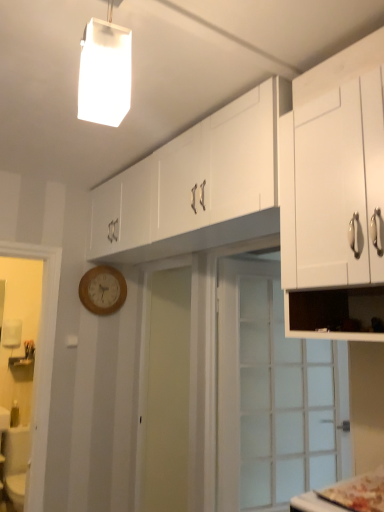
How much space does white glossy cabinet at upper center, marked as the second cabinetry in a front-to-back arrangement, occupy horizontally?

white glossy cabinet at upper center, marked as the second cabinetry in a front-to-back arrangement, is 15.90 inches in width.

Locate an element on the screen. The height and width of the screenshot is (512, 384). wooden clock at center-left is located at coordinates (102, 290).

Image resolution: width=384 pixels, height=512 pixels. What do you see at coordinates (333, 190) in the screenshot?
I see `white matte cabinet at upper right, arranged as the 1th cabinetry when viewed from the front` at bounding box center [333, 190].

Find the location of `white glossy cabinet at upper center, marked as the second cabinetry in a front-to-back arrangement`. white glossy cabinet at upper center, marked as the second cabinetry in a front-to-back arrangement is located at coordinates (194, 182).

Does wooden clock at center-left turn towards white glossy cabinet at upper center, the 1th cabinetry from the back?

Yes, wooden clock at center-left faces towards white glossy cabinet at upper center, the 1th cabinetry from the back.

From a real-world perspective, who is located lower, wooden clock at center-left or white glossy cabinet at upper center, marked as the second cabinetry in a front-to-back arrangement?

From a 3D spatial view, wooden clock at center-left is below.

Is wooden clock at center-left inside the boundaries of white glossy cabinet at upper center, the 1th cabinetry from the back, or outside?

The correct answer is: outside.

Is the surface of clear glass door at center in direct contact with white matte cabinet at upper right, arranged as the 1th cabinetry when viewed from the front?

No, clear glass door at center is not beside white matte cabinet at upper right, arranged as the 1th cabinetry when viewed from the front.

Identify the location of the 1st cabinetry above the clear glass door at center (from the image's perspective). The width and height of the screenshot is (384, 512). (333, 190).

Is clear glass door at center to the left of white matte cabinet at upper right, placed as the 2th cabinetry when sorted from back to front, from the viewer's perspective?

No, clear glass door at center is not to the left of white matte cabinet at upper right, placed as the 2th cabinetry when sorted from back to front.

Is clear glass door at center not inside white matte cabinet at upper right, arranged as the 1th cabinetry when viewed from the front?

Absolutely, clear glass door at center is external to white matte cabinet at upper right, arranged as the 1th cabinetry when viewed from the front.

Is white matte rectangular light fixture at upper center oriented away from wooden clock at center-left?

No, wooden clock at center-left is not at the back of white matte rectangular light fixture at upper center.

In the scene shown: Is white matte rectangular light fixture at upper center touching wooden clock at center-left?

There is a gap between white matte rectangular light fixture at upper center and wooden clock at center-left.

How far apart are white matte rectangular light fixture at upper center and wooden clock at center-left?

white matte rectangular light fixture at upper center and wooden clock at center-left are 1.74 meters apart from each other.

Considering the sizes of objects white matte rectangular light fixture at upper center and wooden clock at center-left in the image provided, who is smaller, white matte rectangular light fixture at upper center or wooden clock at center-left?

white matte rectangular light fixture at upper center is smaller.

Find the location of a particular element. This screenshot has height=512, width=384. clock lying behind the clear glass door at center is located at coordinates (102, 290).

Between clear glass door at center and wooden clock at center-left, which one appears on the right side from the viewer's perspective?

clear glass door at center.

Is clear glass door at center looking in the opposite direction of wooden clock at center-left?

No, clear glass door at center is not facing the opposite direction of wooden clock at center-left.

Is clear glass door at center directly adjacent to wooden clock at center-left?

clear glass door at center is not next to wooden clock at center-left, and they're not touching.

Does point (112, 311) lie in front of point (96, 19)?

That is False.

From a real-world perspective, is wooden clock at center-left beneath white matte rectangular light fixture at upper center?

Indeed, from a real-world perspective, wooden clock at center-left is positioned beneath white matte rectangular light fixture at upper center.

Which of these two, wooden clock at center-left or white matte rectangular light fixture at upper center, is smaller?

white matte rectangular light fixture at upper center.

Is wooden clock at center-left wider than white matte rectangular light fixture at upper center?

No.

Based on the photo, considering their positions, is clear glass door at center located in front of or behind white matte rectangular light fixture at upper center?

Clearly, clear glass door at center is behind white matte rectangular light fixture at upper center.

Is clear glass door at center oriented towards white matte rectangular light fixture at upper center?

No, clear glass door at center is not facing towards white matte rectangular light fixture at upper center.

From a real-world perspective, does clear glass door at center sit lower than white matte rectangular light fixture at upper center?

Yes, from a real-world perspective, clear glass door at center is under white matte rectangular light fixture at upper center.

Does point (301, 382) lie in front of point (126, 38)?

That is False.

Considering the relative sizes of white matte cabinet at upper right, arranged as the 1th cabinetry when viewed from the front, and white glossy cabinet at upper center, marked as the second cabinetry in a front-to-back arrangement, in the image provided, is white matte cabinet at upper right, arranged as the 1th cabinetry when viewed from the front, wider than white glossy cabinet at upper center, marked as the second cabinetry in a front-to-back arrangement,?

Incorrect, the width of white matte cabinet at upper right, arranged as the 1th cabinetry when viewed from the front, does not surpass that of white glossy cabinet at upper center, marked as the second cabinetry in a front-to-back arrangement.

Can you confirm if white matte cabinet at upper right, placed as the 2th cabinetry when sorted from back to front, is smaller than white glossy cabinet at upper center, marked as the second cabinetry in a front-to-back arrangement?

Yes.

Is white matte cabinet at upper right, placed as the 2th cabinetry when sorted from back to front, oriented away from white glossy cabinet at upper center, the 1th cabinetry from the back?

No, white glossy cabinet at upper center, the 1th cabinetry from the back, is not at the back of white matte cabinet at upper right, placed as the 2th cabinetry when sorted from back to front.

Locate an element on the screen. This screenshot has width=384, height=512. the 1st cabinetry in front when counting from the wooden clock at center-left is located at coordinates 194,182.

The image size is (384, 512). In order to click on door below the white matte cabinet at upper right, arranged as the 1th cabinetry when viewed from the front (from the image's perspective) in this screenshot , I will do `click(274, 397)`.

Estimate the real-world distances between objects in this image. Which object is closer to white glossy cabinet at upper center, the 1th cabinetry from the back, white matte cabinet at upper right, placed as the 2th cabinetry when sorted from back to front, or wooden clock at center-left?

white matte cabinet at upper right, placed as the 2th cabinetry when sorted from back to front.

From the image, which object appears to be nearer to clear glass door at center, white matte rectangular light fixture at upper center or white glossy cabinet at upper center, marked as the second cabinetry in a front-to-back arrangement?

white glossy cabinet at upper center, marked as the second cabinetry in a front-to-back arrangement, is positioned closer to the anchor clear glass door at center.

Based on their spatial positions, is white matte cabinet at upper right, arranged as the 1th cabinetry when viewed from the front, or white glossy cabinet at upper center, the 1th cabinetry from the back, closer to clear glass door at center?

white glossy cabinet at upper center, the 1th cabinetry from the back, is positioned closer to the anchor clear glass door at center.

When comparing their distances from clear glass door at center, does white glossy cabinet at upper center, marked as the second cabinetry in a front-to-back arrangement, or white matte rectangular light fixture at upper center seem further?

The object further to clear glass door at center is white matte rectangular light fixture at upper center.

When comparing their distances from white glossy cabinet at upper center, marked as the second cabinetry in a front-to-back arrangement, does white matte rectangular light fixture at upper center or wooden clock at center-left seem closer?

Among the two, wooden clock at center-left is located nearer to white glossy cabinet at upper center, marked as the second cabinetry in a front-to-back arrangement.

From the image, which object appears to be farther from wooden clock at center-left, white matte rectangular light fixture at upper center or clear glass door at center?

Among the two, white matte rectangular light fixture at upper center is located further to wooden clock at center-left.

Estimate the real-world distances between objects in this image. Which object is closer to white matte rectangular light fixture at upper center, wooden clock at center-left or white matte cabinet at upper right, placed as the 2th cabinetry when sorted from back to front?

Among the two, white matte cabinet at upper right, placed as the 2th cabinetry when sorted from back to front, is located nearer to white matte rectangular light fixture at upper center.

When comparing their distances from wooden clock at center-left, does white matte cabinet at upper right, placed as the 2th cabinetry when sorted from back to front, or white matte rectangular light fixture at upper center seem further?

Based on the image, white matte rectangular light fixture at upper center appears to be further to wooden clock at center-left.

The width and height of the screenshot is (384, 512). I want to click on door located between white matte cabinet at upper right, placed as the 2th cabinetry when sorted from back to front, and wooden clock at center-left in the depth direction, so click(x=274, y=397).

The image size is (384, 512). Find the location of `cabinetry between white matte cabinet at upper right, arranged as the 1th cabinetry when viewed from the front, and clear glass door at center from front to back`. cabinetry between white matte cabinet at upper right, arranged as the 1th cabinetry when viewed from the front, and clear glass door at center from front to back is located at coordinates (194, 182).

Find the location of a particular element. The height and width of the screenshot is (512, 384). door between white glossy cabinet at upper center, the 1th cabinetry from the back, and wooden clock at center-left in the front-back direction is located at coordinates (274, 397).

This screenshot has height=512, width=384. In order to click on door located between white matte rectangular light fixture at upper center and wooden clock at center-left in the depth direction in this screenshot , I will do `click(274, 397)`.